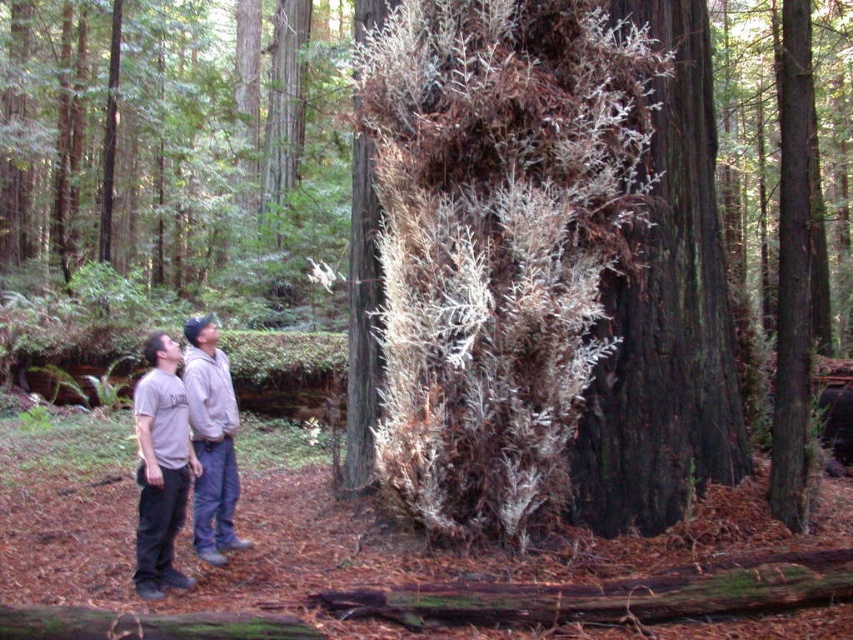
Is dark brown rough bark at center above gray cotton t-shirt at lower left?

Indeed, dark brown rough bark at center is positioned over gray cotton t-shirt at lower left.

Can you confirm if dark brown rough bark at center is wider than gray cotton t-shirt at lower left?

Yes, dark brown rough bark at center is wider than gray cotton t-shirt at lower left.

Who is more forward, (643, 525) or (171, 451)?

Point (171, 451)

The image size is (853, 640). In order to click on dark brown rough bark at center in this screenshot , I will do `click(666, 317)`.

Does gray cotton t-shirt at lower left appear over gray fleece jacket at lower left?

No, gray cotton t-shirt at lower left is not above gray fleece jacket at lower left.

Can you confirm if gray cotton t-shirt at lower left is positioned below gray fleece jacket at lower left?

Yes, gray cotton t-shirt at lower left is below gray fleece jacket at lower left.

Describe the element at coordinates (171, 460) in the screenshot. This screenshot has height=640, width=853. I see `gray cotton t-shirt at lower left` at that location.

You are a GUI agent. You are given a task and a screenshot of the screen. Output one action in this format:
    pyautogui.click(x=<x>, y=<y>)
    Task: Click on the gray cotton t-shirt at lower left
    This screenshot has width=853, height=640.
    Given the screenshot: What is the action you would take?
    pyautogui.click(x=171, y=460)

Which is in front, point (631, 454) or point (206, 451)?

Positioned in front is point (206, 451).

Is point (577, 428) in front of point (221, 472)?

No, it is not.

At what (x,y) coordinates should I click in order to perform the action: click on dark brown rough bark at center. Please return your answer as a coordinate pair (x, y). Looking at the image, I should click on (666, 317).